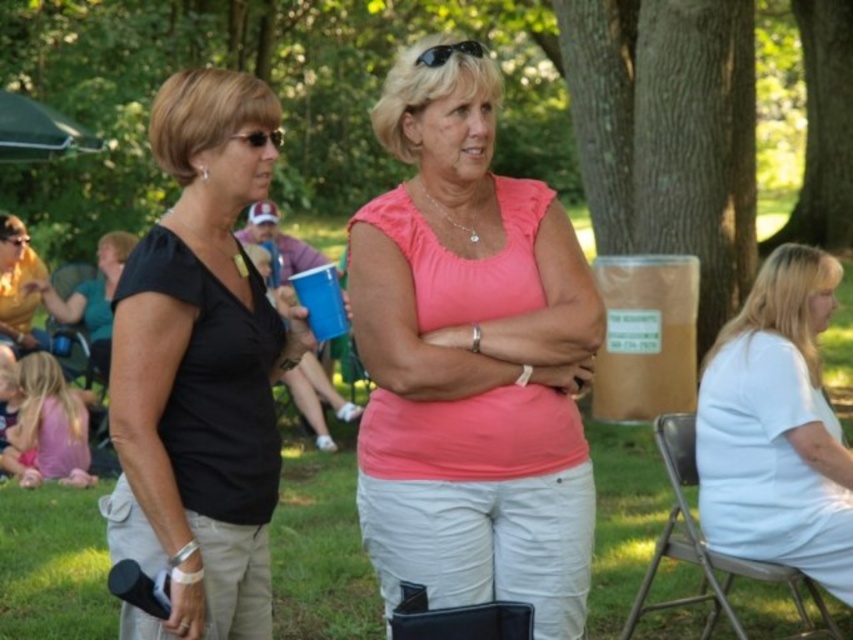
Question: Estimate the real-world distances between objects in this image. Which object is closer to the sunglasses at center?

Choices:
 (A) white cotton shirt at right
 (B) pink matte shirt at center
 (C) metallic silver folding chair at lower right

Answer: (B)

Question: Is black matte shirt at left below brown rough bark tree at center?

Choices:
 (A) yes
 (B) no

Answer: (A)

Question: Can you confirm if white cotton shirt at right is positioned to the left of metallic silver folding chair at lower right?

Choices:
 (A) no
 (B) yes

Answer: (A)

Question: Which of the following is the closest to the observer?

Choices:
 (A) pyautogui.click(x=445, y=48)
 (B) pyautogui.click(x=791, y=3)
 (C) pyautogui.click(x=770, y=481)
 (D) pyautogui.click(x=740, y=627)

Answer: (A)

Question: Which object appears farthest from the camera in this image?

Choices:
 (A) sunglasses at center
 (B) green leafy tree at upper center
 (C) metallic silver folding chair at lower right

Answer: (B)

Question: Can you confirm if brown rough bark tree at center is positioned above metallic silver folding chair at lower right?

Choices:
 (A) no
 (B) yes

Answer: (B)